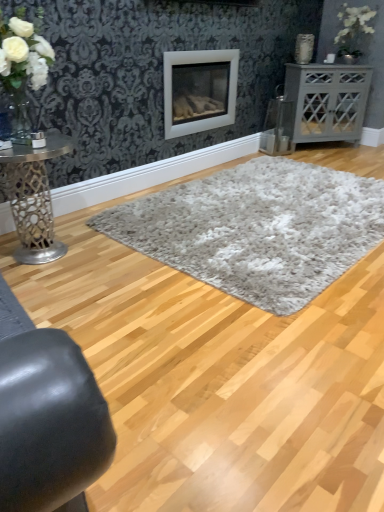
The width and height of the screenshot is (384, 512). I want to click on gray matte cabinet at right, arranged as the second table when ordered from the bottom, so click(327, 101).

You are a GUI agent. You are given a task and a screenshot of the screen. Output one action in this format:
    pyautogui.click(x=<x>, y=<y>)
    Task: Click on the white shag rug at center, which is the second plain from back to front
    This screenshot has width=384, height=512.
    Given the screenshot: What is the action you would take?
    click(218, 378)

Measure the distance between white shag rug at center, the 1th plain in the front-to-back sequence, and camera.

white shag rug at center, the 1th plain in the front-to-back sequence, is 1.13 meters from camera.

Locate an element on the screen. The height and width of the screenshot is (512, 384). white matte wood burning stove at center is located at coordinates (199, 90).

The height and width of the screenshot is (512, 384). I want to click on metallic silver table at left, the second table positioned from the back, so click(34, 198).

Identify the location of gray matte cabinet at right, which is the 1th table in back-to-front order. This screenshot has width=384, height=512. (327, 101).

From the picture: Is metallic silver table at left, marked as the first table in a front-to-back arrangement, oriented towards white matte wood burning stove at center?

No, metallic silver table at left, marked as the first table in a front-to-back arrangement, does not turn towards white matte wood burning stove at center.

This screenshot has width=384, height=512. In the image, there is a metallic silver table at left, marked as the first table in a front-to-back arrangement. In order to click on wood burning stove above it (from the image's perspective) in this screenshot , I will do `click(199, 90)`.

Considering the points (27, 183) and (174, 64), which point is in front, point (27, 183) or point (174, 64)?

The point (27, 183) is in front.

Is gray matte cabinet at right, positioned as the 1th table in right-to-left order, located within white shag rug at center, the 1th plain in the front-to-back sequence?

No, white shag rug at center, the 1th plain in the front-to-back sequence, does not contain gray matte cabinet at right, positioned as the 1th table in right-to-left order.

Can you tell me how much white shag rug at center, which is the second plain from back to front, and gray matte cabinet at right, the 2th table positioned from the front, differ in facing direction?

white shag rug at center, which is the second plain from back to front, and gray matte cabinet at right, the 2th table positioned from the front, are facing 124 degrees away from each other.

Based on the photo, which of these two, white shag rug at center, which is the second plain from back to front, or gray matte cabinet at right, arranged as the second table when ordered from the bottom, is wider?

white shag rug at center, which is the second plain from back to front, is wider.

What are the coordinates of `table lying above the white shag rug at center, which is the second plain from back to front (from the image's perspective)` in the screenshot? It's located at (327, 101).

From a real-world perspective, relative to white fluffy rug at center, the second plain from the front, is white matte wood burning stove at center vertically above or below?

white matte wood burning stove at center is situated higher than white fluffy rug at center, the second plain from the front, in the real world.

Considering the relative positions of white matte wood burning stove at center and white fluffy rug at center, which is counted as the 1th plain, starting from the back, in the image provided, is white matte wood burning stove at center in front of white fluffy rug at center, which is counted as the 1th plain, starting from the back,?

No, white matte wood burning stove at center is behind white fluffy rug at center, which is counted as the 1th plain, starting from the back.

Locate an element on the screen. wood burning stove behind the white fluffy rug at center, the second plain from the front is located at coordinates pyautogui.click(x=199, y=90).

Consider the image. Does white matte wood burning stove at center appear on the left side of white fluffy rug at center, the second plain from the front?

Indeed, white matte wood burning stove at center is positioned on the left side of white fluffy rug at center, the second plain from the front.

From a real-world perspective, is gray matte cabinet at right, which is the 1th table in back-to-front order, positioned above or below white matte wood burning stove at center?

Clearly, from a real-world perspective, gray matte cabinet at right, which is the 1th table in back-to-front order, is below white matte wood burning stove at center.

This screenshot has width=384, height=512. In order to click on wood burning stove that is below the gray matte cabinet at right, positioned as the 1th table in right-to-left order (from the image's perspective) in this screenshot , I will do `click(199, 90)`.

From the picture: Who is shorter, gray matte cabinet at right, marked as the second table in a left-to-right arrangement, or white matte wood burning stove at center?

white matte wood burning stove at center is shorter.

From the image's perspective, which one is positioned lower, gray matte cabinet at right, the 2th table positioned from the front, or white matte wood burning stove at center?

white matte wood burning stove at center.

Could you tell me if white matte wood burning stove at center is turned towards metallic silver table at left, marked as the first table in a front-to-back arrangement?

No, white matte wood burning stove at center is not oriented towards metallic silver table at left, marked as the first table in a front-to-back arrangement.

Is white matte wood burning stove at center not near metallic silver table at left, marked as the first table in a front-to-back arrangement?

Yes, white matte wood burning stove at center and metallic silver table at left, marked as the first table in a front-to-back arrangement, are located far from each other.

From their relative heights in the image, would you say white shag rug at center, which is the second plain from back to front, is taller or shorter than white matte wood burning stove at center?

white shag rug at center, which is the second plain from back to front, is shorter than white matte wood burning stove at center.

How far apart are white shag rug at center, the 1th plain in the front-to-back sequence, and white matte wood burning stove at center?

They are 6.03 feet apart.

Is white shag rug at center, the 1th plain in the front-to-back sequence, looking in the opposite direction of white matte wood burning stove at center?

That's not correct — white shag rug at center, the 1th plain in the front-to-back sequence, is not looking away from white matte wood burning stove at center.

From the image's perspective, does white shag rug at center, which is the second plain from back to front, appear higher than white matte wood burning stove at center?

No.

This screenshot has height=512, width=384. There is a metallic silver table at left, the second table positioned from the back. Identify the location of the 2nd plain above it (from the image's perspective). (257, 229).

In the scene shown: Which point is more distant from viewer, [9,164] or [276,207]?

The point [276,207] is farther.

Who is more distant, metallic silver table at left, which is counted as the 1th table, starting from the bottom, or white fluffy rug at center, which is counted as the 1th plain, starting from the back?

white fluffy rug at center, which is counted as the 1th plain, starting from the back, is behind.

Looking at their sizes, would you say metallic silver table at left, marked as the first table in a front-to-back arrangement, is wider or thinner than white fluffy rug at center, the second plain from the front?

metallic silver table at left, marked as the first table in a front-to-back arrangement, is thinner than white fluffy rug at center, the second plain from the front.

Find the location of a particular element. wood burning stove that appears on the right of metallic silver table at left, acting as the first table starting from the left is located at coordinates (199, 90).

This screenshot has height=512, width=384. Identify the location of table that is the 2nd one when counting backward from the white shag rug at center, which is the second plain from back to front. (327, 101).

When comparing their distances from metallic silver table at left, which is the 2th table in right-to-left order, does white matte wood burning stove at center or white fluffy rug at center, the second plain from the front, seem closer?

white fluffy rug at center, the second plain from the front, is closer to metallic silver table at left, which is the 2th table in right-to-left order.

Based on their spatial positions, is white fluffy rug at center, the second plain from the front, or metallic silver table at left, which is the 2th table in right-to-left order, further from white matte wood burning stove at center?

The object further to white matte wood burning stove at center is metallic silver table at left, which is the 2th table in right-to-left order.

Looking at the image, which one is located further to white shag rug at center, the 1th plain in the front-to-back sequence, white fluffy rug at center, the second plain from the front, or gray matte cabinet at right, which is the 1th table in back-to-front order?

The object further to white shag rug at center, the 1th plain in the front-to-back sequence, is gray matte cabinet at right, which is the 1th table in back-to-front order.

From the image, which object appears to be farther from gray matte cabinet at right, arranged as the second table when ordered from the bottom, white fluffy rug at center, which is counted as the 1th plain, starting from the back, or white shag rug at center, which is the second plain from back to front?

white shag rug at center, which is the second plain from back to front.

Based on their spatial positions, is metallic silver table at left, marked as the first table in a front-to-back arrangement, or white shag rug at center, which is the second plain from back to front, further from gray matte cabinet at right, arranged as the second table when ordered from the bottom?

metallic silver table at left, marked as the first table in a front-to-back arrangement, is further to gray matte cabinet at right, arranged as the second table when ordered from the bottom.

Looking at this image, based on their spatial positions, is metallic silver table at left, which is the 2th table in right-to-left order, or white shag rug at center, the 1th plain in the front-to-back sequence, further from white fluffy rug at center, which is counted as the 1th plain, starting from the back?

Based on the image, metallic silver table at left, which is the 2th table in right-to-left order, appears to be further to white fluffy rug at center, which is counted as the 1th plain, starting from the back.

Looking at the image, which one is located closer to metallic silver table at left, which is counted as the 1th table, starting from the bottom, white shag rug at center, which is the second plain from back to front, or gray matte cabinet at right, positioned as the 1th table in right-to-left order?

white shag rug at center, which is the second plain from back to front, is closer to metallic silver table at left, which is counted as the 1th table, starting from the bottom.

Looking at the image, which one is located further to white shag rug at center, the 1th plain in the front-to-back sequence, white matte wood burning stove at center or white fluffy rug at center, which is counted as the 1th plain, starting from the back?

white matte wood burning stove at center.

This screenshot has width=384, height=512. What are the coordinates of `wood burning stove between metallic silver table at left, marked as the first table in a front-to-back arrangement, and gray matte cabinet at right, positioned as the 1th table in right-to-left order, from left to right` in the screenshot? It's located at (199, 90).

I want to click on plain between white shag rug at center, which is the second plain from back to front, and gray matte cabinet at right, the 2th table positioned from the front, in the front-back direction, so click(257, 229).

This screenshot has height=512, width=384. In order to click on table between white shag rug at center, which is the second plain from back to front, and white matte wood burning stove at center from front to back in this screenshot , I will do `click(34, 198)`.

Where is `wood burning stove located between white shag rug at center, which is the second plain from back to front, and gray matte cabinet at right, arranged as the second table when ordered from the bottom, in the depth direction`? The width and height of the screenshot is (384, 512). wood burning stove located between white shag rug at center, which is the second plain from back to front, and gray matte cabinet at right, arranged as the second table when ordered from the bottom, in the depth direction is located at coordinates (199, 90).